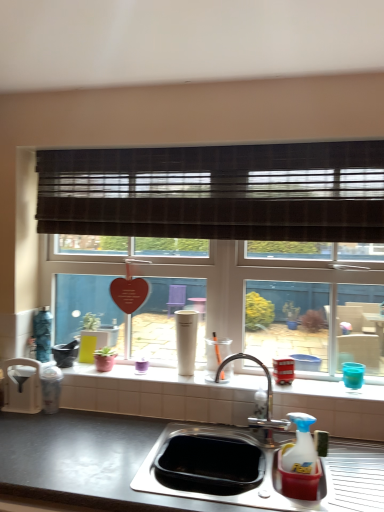
The height and width of the screenshot is (512, 384). I want to click on vacant region in front of metallic silver blender at lower left, which ranks as the second appliance in left-to-right order, so click(x=45, y=426).